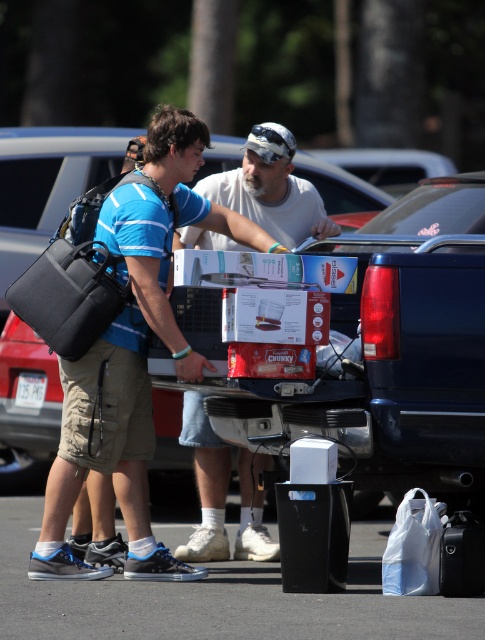
You are a delivery person who needs to place a package in the truck bed. The package is 1.2 meters long. You see the matte black backpack at left and the white matte shirt at center. Can you fit the package between them?

The distance between the matte black backpack at left and the white matte shirt at center is 1.00 meters, so the package cannot be placed between them since it is longer than the available space.

You are a delivery person trying to load a large package into the truck bed. You see the red cardboard boxes at center and the white matte shirt at center. Which item is larger and should you consider its size when placing the new package?

The red cardboard boxes at center is bigger than the white matte shirt at center, so you should consider the size of the red cardboard boxes at center when placing the new package to ensure there is enough space.